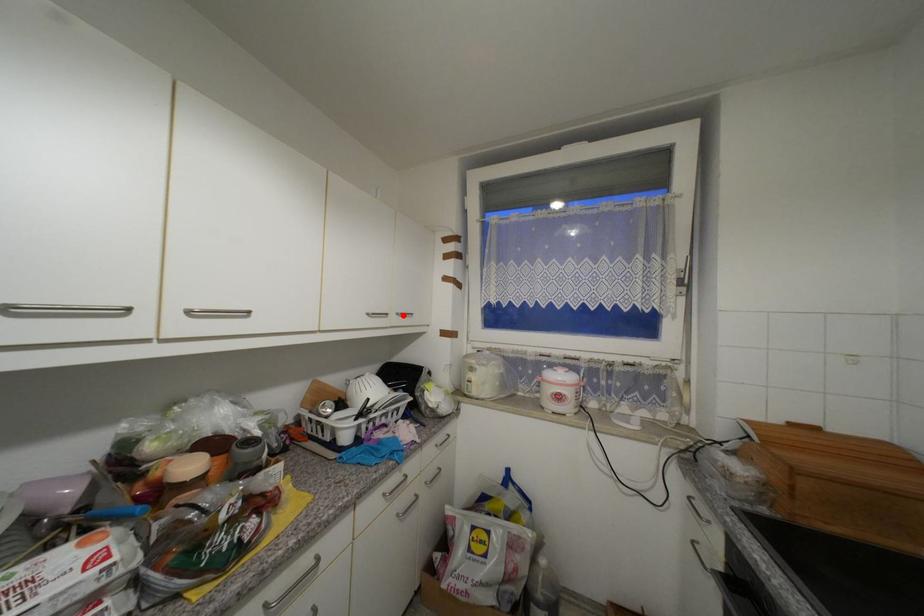
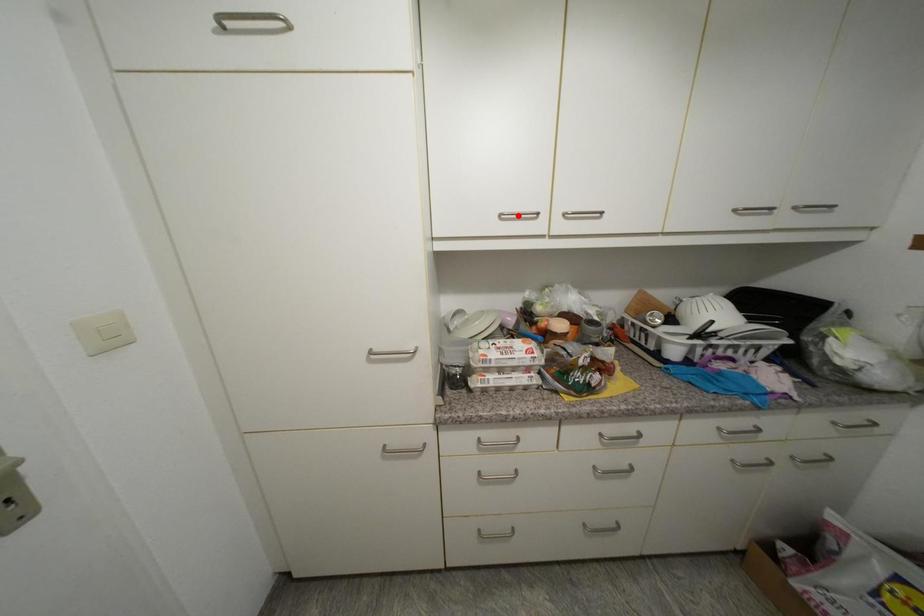
I am providing you with two images of the same scene from different viewpoints. A red point is marked on the first image and another point is marked on the second image. Does the point marked in image1 correspond to the same location as the one in image2?

No